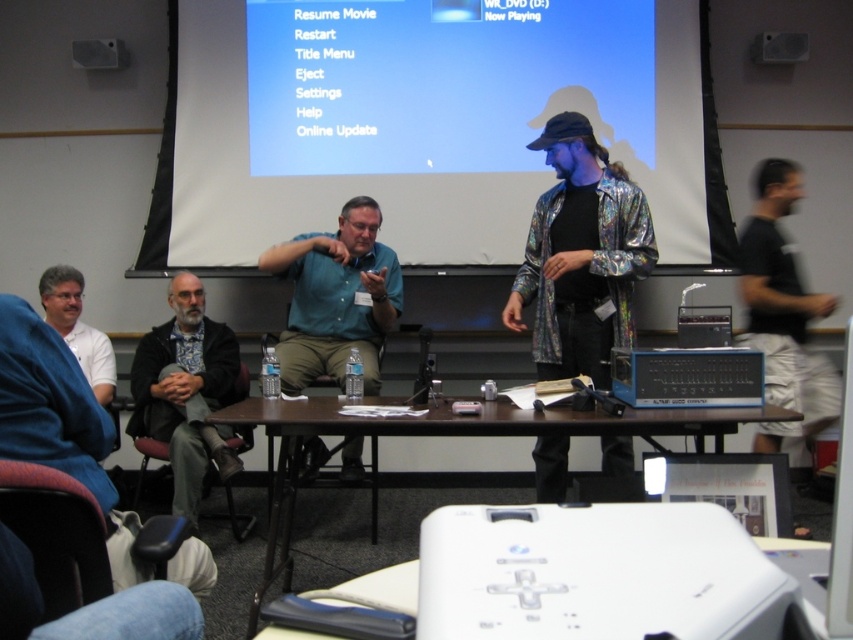
Can you confirm if white matte projection screen at upper center is thinner than green matte shirt at center?

In fact, white matte projection screen at upper center might be wider than green matte shirt at center.

From the picture: Is white matte projection screen at upper center wider than green matte shirt at center?

Yes.

Between point (646, 204) and point (389, 284), which one is positioned in front?

Point (646, 204) is more forward.

Locate an element on the screen. white matte projection screen at upper center is located at coordinates [433, 125].

Does white plastic projector at center appear under brown wooden table at center?

No.

Does white plastic projector at center have a larger size compared to brown wooden table at center?

Incorrect, white plastic projector at center is not larger than brown wooden table at center.

Where is `white plastic projector at center`? white plastic projector at center is located at coordinates (595, 573).

Is point (624, 150) positioned in front of point (618, 604)?

No, (624, 150) is further to viewer.

Is white matte projection screen at upper center wider than white plastic projector at center?

Yes.

Between point (680, 17) and point (677, 577), which one is positioned in front?

Point (677, 577) is more forward.

Where is `white matte projection screen at upper center`? white matte projection screen at upper center is located at coordinates [433, 125].